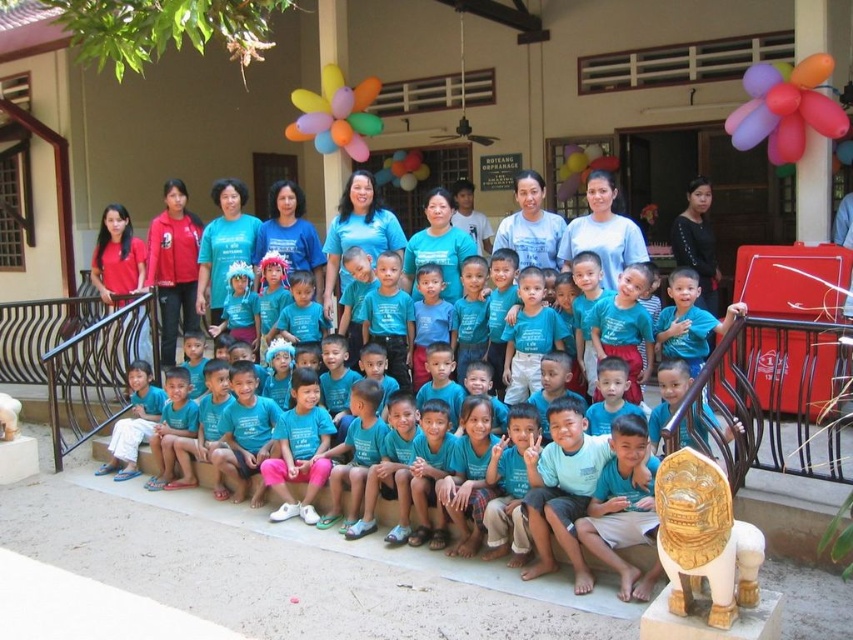
Is multicolored glossy balloon at upper right wider than translucent multicolored balloons at center?

No, multicolored glossy balloon at upper right is not wider than translucent multicolored balloons at center.

Based on the photo, which is more to the left, multicolored glossy balloon at upper right or translucent multicolored balloons at center?

From the viewer's perspective, translucent multicolored balloons at center appears more on the left side.

Who is more forward, (776, 118) or (404, 163)?

Positioned in front is point (776, 118).

The width and height of the screenshot is (853, 640). Identify the location of multicolored glossy balloon at upper right. (785, 108).

Which is more to the right, multicolored glossy balloon at upper right or multicolored balloons at center?

From the viewer's perspective, multicolored glossy balloon at upper right appears more on the right side.

How distant is multicolored glossy balloon at upper right from multicolored balloons at center?

multicolored glossy balloon at upper right is 5.09 meters away from multicolored balloons at center.

Which is in front, point (730, 141) or point (355, 145)?

Positioned in front is point (730, 141).

Locate an element on the screen. The height and width of the screenshot is (640, 853). multicolored glossy balloon at upper right is located at coordinates (785, 108).

Can you confirm if multicolored balloons at center is positioned to the right of translucent multicolored balloons at center?

No, multicolored balloons at center is not to the right of translucent multicolored balloons at center.

Which is behind, point (294, 122) or point (413, 170)?

Positioned behind is point (294, 122).

Who is more distant from viewer, (364,83) or (393,160)?

The point (393,160) is more distant.

Identify the location of multicolored balloons at center. (335, 115).